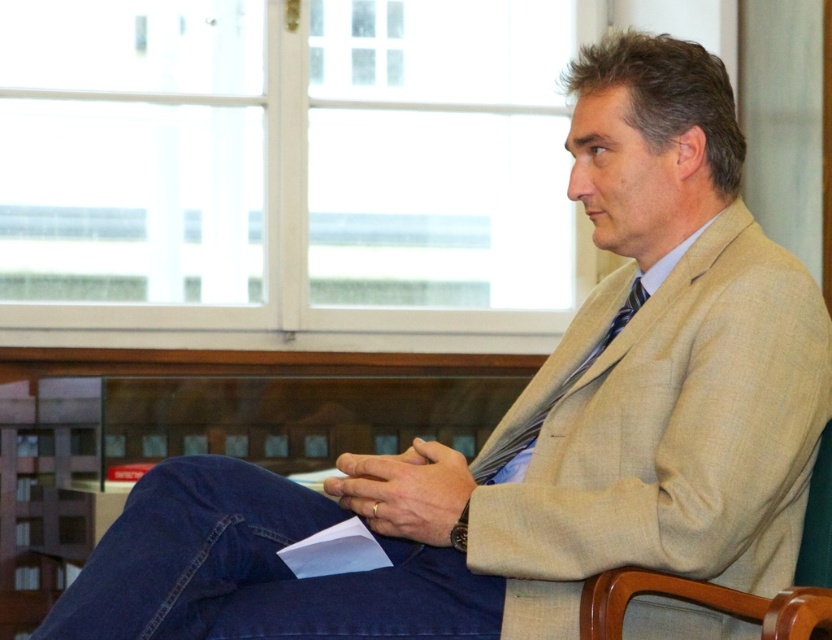
You are a photographer setting up for a portrait. You need to adjust the focus so that both the light brown wood chair at center and the silky blue tie at center are in sharp focus. Given their positions relative to you, which object should you focus on to ensure both are clear?

You should focus on the light brown wood chair at center because it is closer to the viewer, and focusing on the closer object will ensure both it and the silky blue tie at center are in focus.

You are standing at the origin point of the image coordinate system. You want to walk towards the light brown wood chair at center. What are the coordinates you need to move to reach it?

The coordinates to reach the light brown wood chair at center are at point [731,588].

You are a photographer setting up for a portrait session. The subject is sitting in the scene described. You want to position a spotlight to the left of the silky blue tie at center to highlight it. Will the spotlight also illuminate the light brown wood chair at center?

The light brown wood chair at center is to the right of the silky blue tie at center. Since the spotlight is placed to the left of the silky blue tie at center, the chair would be on the opposite side and might not be directly illuminated by the spotlight.